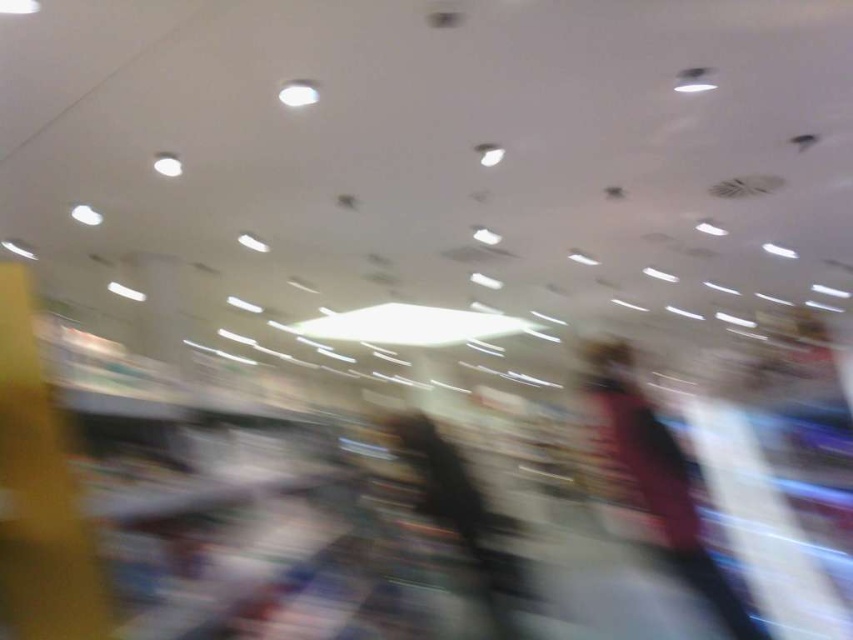
Based on the photo, you are a photographer who just took a blurry photo of two fabrics in a mall. You remember that the dark pink fabric at center and the dark gray fabric jacket at center were in the frame. Based on the description, which fabric is located to the right of the other?

The dark pink fabric at center is positioned on the right side of the dark gray fabric jacket at center.

You are a fashion designer observing fabrics in a store. You see the dark pink fabric at center and the dark gray fabric jacket at center. How far apart are these two items?

The dark pink fabric at center and the dark gray fabric jacket at center are 38.70 inches apart.